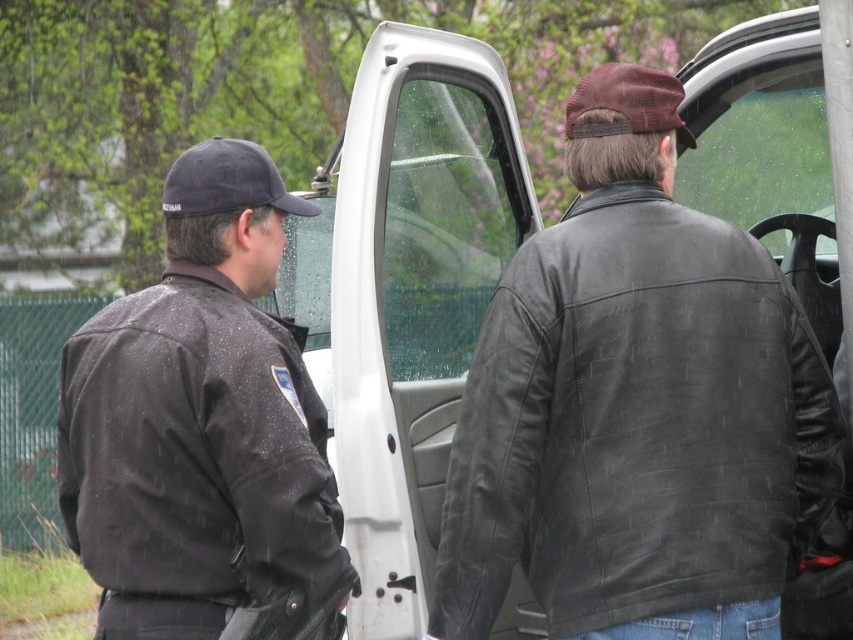
Question: Which object appears closest to the camera in this image?

Choices:
 (A) black leather jacket at right
 (B) black leather jacket at left

Answer: (B)

Question: Which object is closer to the camera taking this photo?

Choices:
 (A) black leather jacket at left
 (B) black leather jacket at right
 (C) black fabric baseball cap at left

Answer: (A)

Question: Is black leather jacket at right to the right of black leather jacket at left from the viewer's perspective?

Choices:
 (A) yes
 (B) no

Answer: (A)

Question: Does black leather jacket at left come behind black fabric baseball cap at left?

Choices:
 (A) yes
 (B) no

Answer: (B)

Question: Is the position of black leather jacket at right less distant than that of black leather jacket at left?

Choices:
 (A) yes
 (B) no

Answer: (B)

Question: Which object is farther from the camera taking this photo?

Choices:
 (A) black leather jacket at left
 (B) black leather jacket at right

Answer: (B)